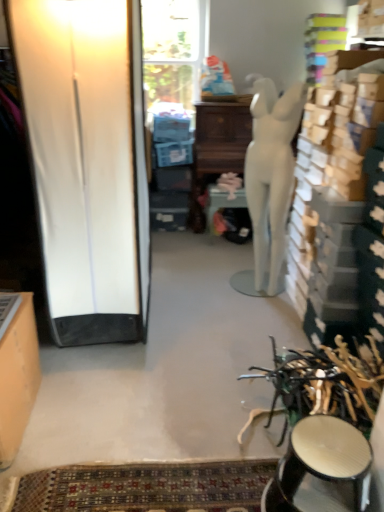
Identify the location of empty space that is to the right of matte orange cabinet at left. (80, 423).